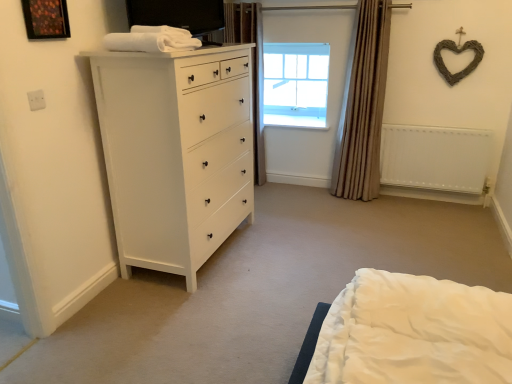
Question: From the image's perspective, relative to clear glass window at upper center, is white matte chest of drawers at left above or below?

Choices:
 (A) below
 (B) above

Answer: (A)

Question: Is point (183, 190) positioned closer to the camera than point (313, 49)?

Choices:
 (A) farther
 (B) closer

Answer: (B)

Question: Estimate the real-world distances between objects in this image. Which object is farther from the white soft towel at upper left?

Choices:
 (A) wooden picture frame at upper left
 (B) white matte chest of drawers at left
 (C) beige fabric curtain at right, which is counted as the second curtain, starting from the left
 (D) clear glass window at upper center
 (E) brown textured curtain at upper center, which is counted as the 1th curtain, starting from the left

Answer: (D)

Question: Which is nearer to the clear glass window at upper center?

Choices:
 (A) white matte chest of drawers at left
 (B) beige fabric curtain at right, the 1th curtain viewed from the right
 (C) brown textured curtain at upper center, which is counted as the 1th curtain, starting from the left
 (D) white matte radiator at right
 (E) wooden picture frame at upper left

Answer: (C)